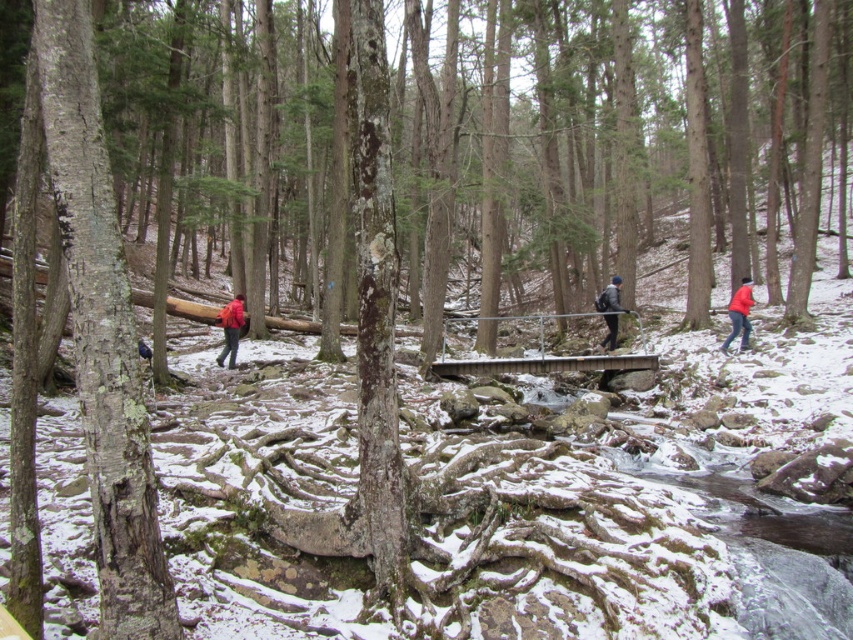
Question: Which of these objects is positioned closest to the lichen-covered bark tree at left?

Choices:
 (A) red matte jacket at right
 (B) dark gray backpack at center
 (C) red fabric backpack at center-left

Answer: (C)

Question: Can you confirm if red fabric backpack at center-left is thinner than dark gray backpack at center?

Choices:
 (A) no
 (B) yes

Answer: (A)

Question: Which point is farther to the camera?

Choices:
 (A) red matte jacket at right
 (B) dark gray backpack at center
 (C) lichen-covered bark tree at left
 (D) red fabric backpack at center-left

Answer: (B)

Question: Does red fabric backpack at center-left appear under dark gray backpack at center?

Choices:
 (A) yes
 (B) no

Answer: (A)

Question: Which object is the closest to the dark gray backpack at center?

Choices:
 (A) lichen-covered bark tree at left
 (B) red matte jacket at right

Answer: (B)

Question: Is lichen-covered bark tree at left thinner than red fabric backpack at center-left?

Choices:
 (A) no
 (B) yes

Answer: (A)